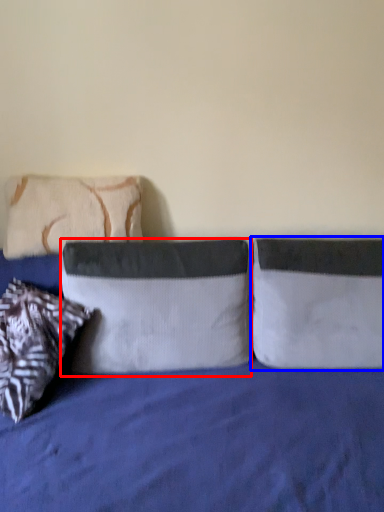
Question: Which point is further to the camera, pillow (highlighted by a red box) or pillow (highlighted by a blue box)?

Choices:
 (A) pillow
 (B) pillow

Answer: (B)